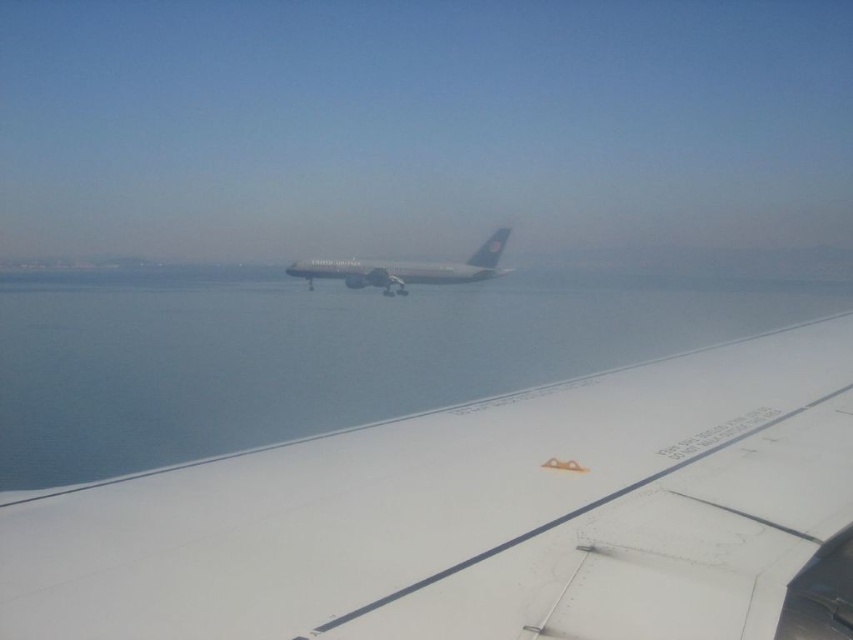
You are a passenger on an airplane and notice two objects through the window. The white matte wing at center and the blue water at center. Which object takes up more area in your view?

The blue water at center takes up more area in your view because the white matte wing at center occupies less space than blue water at center.

You are a flight attendant on an airplane and need to determine which part of the aircraft you are currently looking at. The scene shows a white matte wing at center and a white glossy airplane wing at center. Which one is wider?

The white matte wing at center might be wider than white glossy airplane wing at center according to the description.

You are a passenger sitting in the airplane and looking out the window. You see the silver metallic airplane at center and the white glossy airplane wing at center. Which object appears bigger in your view?

The silver metallic airplane at center appears bigger in your view because it has a larger size compared to the white glossy airplane wing at center.